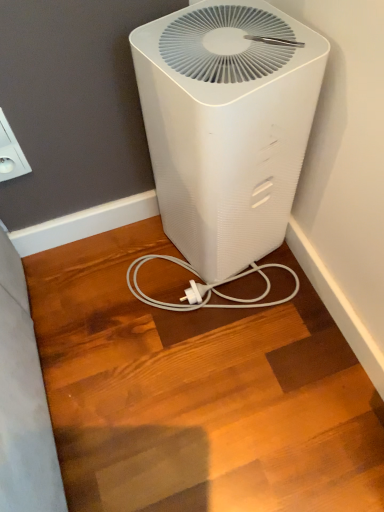
What do you see at coordinates (226, 126) in the screenshot? I see `white plastic air purifier at center` at bounding box center [226, 126].

Where is `white plastic air purifier at center`? white plastic air purifier at center is located at coordinates (226, 126).

Locate an element on the screen. The height and width of the screenshot is (512, 384). white plastic outlet at upper left is located at coordinates (10, 153).

The width and height of the screenshot is (384, 512). What do you see at coordinates (10, 153) in the screenshot? I see `white plastic outlet at upper left` at bounding box center [10, 153].

In order to face white plastic outlet at upper left, should I rotate leftwards or rightwards?

To face it directly, rotate left by 24.507 degrees.

What is the approximate width of white plastic outlet at upper left?

The width of white plastic outlet at upper left is 1.15 inches.

Locate an element on the screen. white plastic air purifier at center is located at coordinates (226, 126).

Based on the photo, between white plastic air purifier at center and white plastic outlet at upper left, which one appears on the left side from the viewer's perspective?

white plastic outlet at upper left.

Based on the photo, considering their positions, is white plastic air purifier at center located in front of or behind white plastic outlet at upper left?

white plastic air purifier at center is in front of white plastic outlet at upper left.

Considering the points (259, 131) and (3, 127), which point is behind, point (259, 131) or point (3, 127)?

The point (3, 127) is more distant.

From the image's perspective, would you say white plastic air purifier at center is shown under white plastic outlet at upper left?

Yes, from the image's perspective, white plastic air purifier at center is below white plastic outlet at upper left.

From a real-world perspective, which object stands above the other?

From a 3D spatial view, white plastic outlet at upper left is above.

Is white plastic air purifier at center wider than white plastic outlet at upper left?

Yes, white plastic air purifier at center is wider than white plastic outlet at upper left.

Considering the sizes of white plastic air purifier at center and white plastic outlet at upper left in the image, is white plastic air purifier at center taller or shorter than white plastic outlet at upper left?

Clearly, white plastic air purifier at center is taller compared to white plastic outlet at upper left.

Considering the sizes of objects white plastic air purifier at center and white plastic outlet at upper left in the image provided, who is bigger, white plastic air purifier at center or white plastic outlet at upper left?

white plastic air purifier at center.

Is white plastic air purifier at center spatially inside white plastic outlet at upper left, or outside of it?

white plastic air purifier at center is outside white plastic outlet at upper left.

Is white plastic air purifier at center with white plastic outlet at upper left?

There is a gap between white plastic air purifier at center and white plastic outlet at upper left.

Is white plastic air purifier at center turned away from white plastic outlet at upper left?

No.

Can you tell me how much white plastic air purifier at center and white plastic outlet at upper left differ in facing direction?

They differ by 12.2 degrees in their facing directions.

At what (x,y) coordinates should I click in order to perform the action: click on electric outlet that is behind the white plastic air purifier at center. Please return your answer as a coordinate pair (x, y). Looking at the image, I should click on (10, 153).

Based on the photo, which is more to the left, white plastic outlet at upper left or white plastic air purifier at center?

white plastic outlet at upper left.

In the image, is white plastic outlet at upper left positioned in front of or behind white plastic air purifier at center?

white plastic outlet at upper left is behind white plastic air purifier at center.

Is point (3, 135) less distant than point (183, 71)?

No, it is not.

From the image's perspective, is white plastic outlet at upper left located above or below white plastic air purifier at center?

Clearly, from the image's perspective, white plastic outlet at upper left is above white plastic air purifier at center.

From a real-world perspective, which object rests below the other?

white plastic air purifier at center.

Between white plastic outlet at upper left and white plastic air purifier at center, which one has smaller width?

Thinner between the two is white plastic outlet at upper left.

Can you confirm if white plastic outlet at upper left is shorter than white plastic air purifier at center?

Yes, white plastic outlet at upper left is shorter than white plastic air purifier at center.

Considering the relative sizes of white plastic outlet at upper left and white plastic air purifier at center in the image provided, is white plastic outlet at upper left smaller than white plastic air purifier at center?

Correct, white plastic outlet at upper left occupies less space than white plastic air purifier at center.

Is white plastic outlet at upper left inside the boundaries of white plastic air purifier at center, or outside?

white plastic outlet at upper left is not enclosed by white plastic air purifier at center.

Would you say white plastic outlet at upper left is a long distance from white plastic air purifier at center?

No, white plastic outlet at upper left is in close proximity to white plastic air purifier at center.

Looking at this image, could you tell me if white plastic outlet at upper left is turned towards white plastic air purifier at center?

No, white plastic outlet at upper left is not turned towards white plastic air purifier at center.

How many degrees apart are the facing directions of white plastic outlet at upper left and white plastic air purifier at center?

They differ by 12.2 degrees in their facing directions.

How far apart are white plastic outlet at upper left and white plastic air purifier at center?

The distance of white plastic outlet at upper left from white plastic air purifier at center is 16.47 inches.

I want to click on home appliance in front of the white plastic outlet at upper left, so click(226, 126).

I want to click on electric outlet above the white plastic air purifier at center (from the image's perspective), so click(x=10, y=153).

The width and height of the screenshot is (384, 512). I want to click on electric outlet above the white plastic air purifier at center (from a real-world perspective), so click(10, 153).